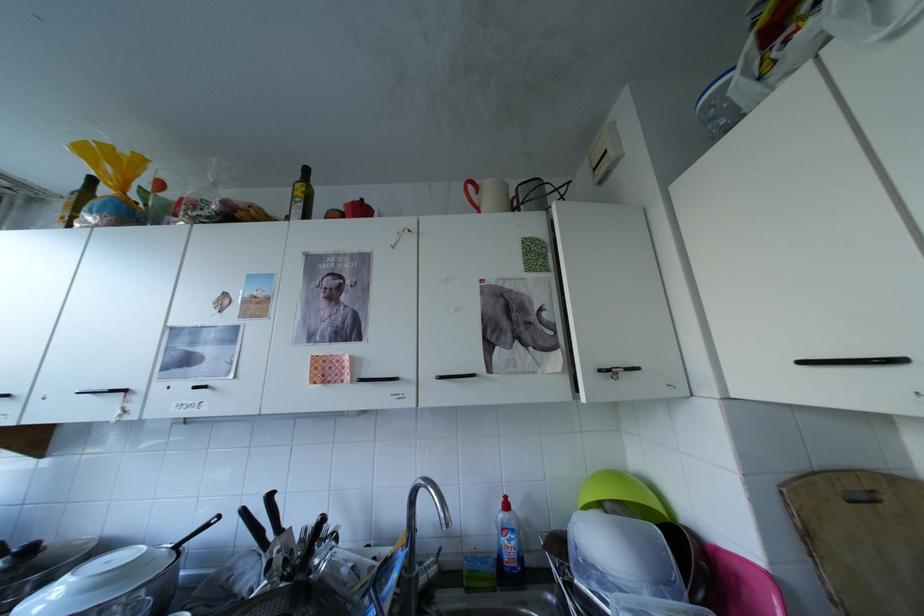
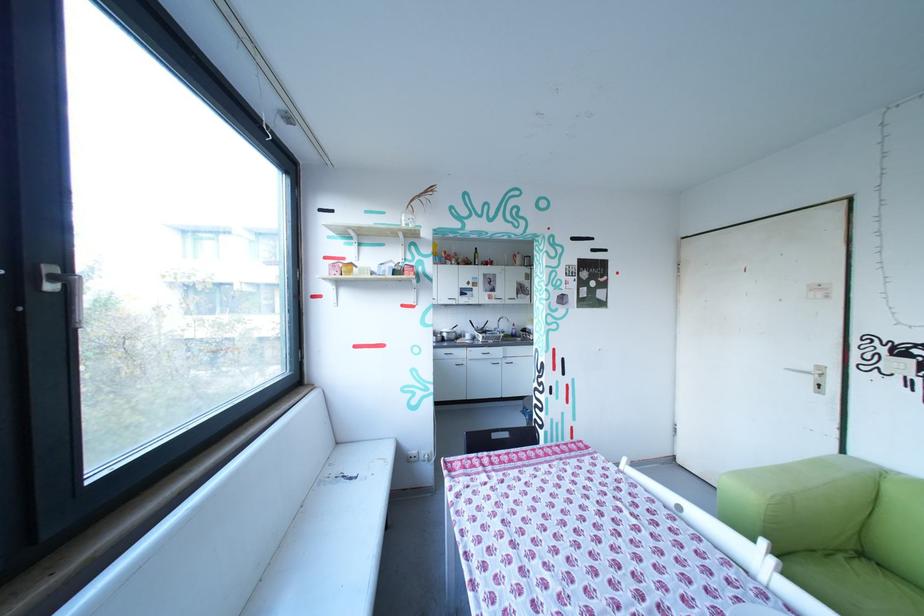
Question: I am providing you with two images of the same scene from different viewpoints. Please identify which objects are invisible in image2.

Choices:
 (A) metal cabinet handle
 (B) green plastic bowl
 (C) blue toothbrush holder
 (D) bottle with yellow cap

Answer: (B)